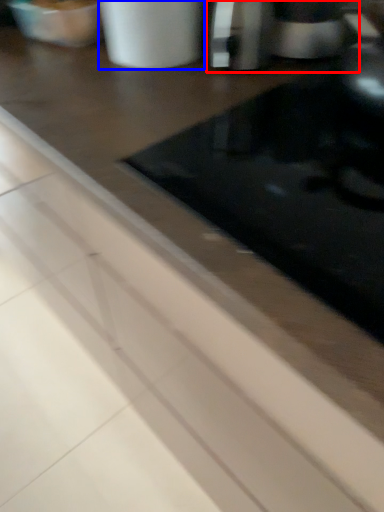
Question: Which object appears closest to the camera in this image, coffee machine (highlighted by a red box) or appliance (highlighted by a blue box)?

Choices:
 (A) coffee machine
 (B) appliance

Answer: (B)